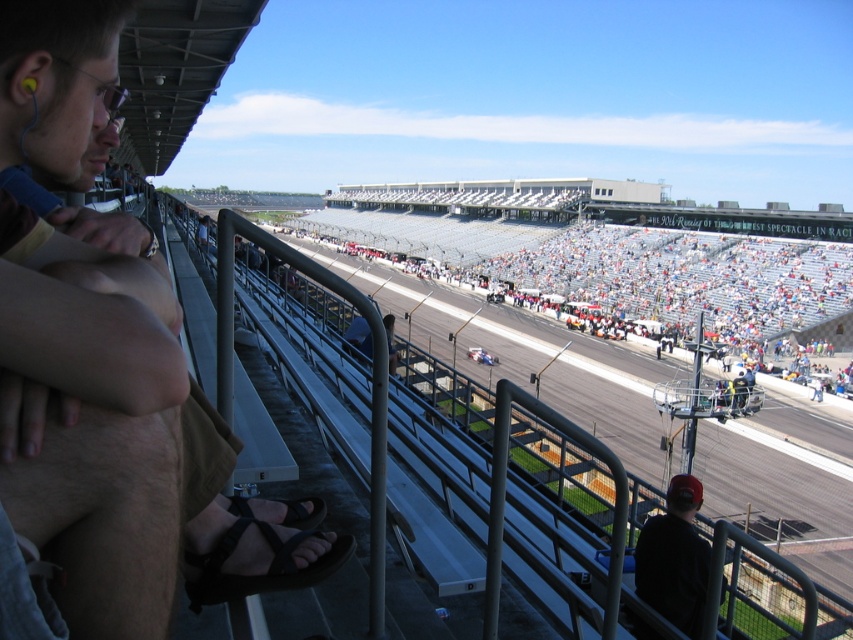
You are a photographer at the racetrack and want to capture both the matte black sandal at lower left and the black fabric cap at lower right in a single photo. Which object should you focus on first to ensure both are in frame?

You should focus on the matte black sandal at lower left first because it is in front of the black fabric cap at lower right, so adjusting the camera to include the front object ensures the one behind is also captured.

You are a spectator at the racetrack and need to find the white plastic seats at center. According to the scene description, where exactly are they positioned?

The white plastic seats at center are located at point (x=633, y=268).

You are standing at the point labeled point (444, 237) and need to reach the starting line of the race. The track is 115.29 meters long. If you start running at a constant speed of 5 meters per second, how many seconds will it take you to reach the starting line?

It will take 23.06 seconds to reach the starting line because 115.29 meters divided by 5 meters per second equals 23.06 seconds.